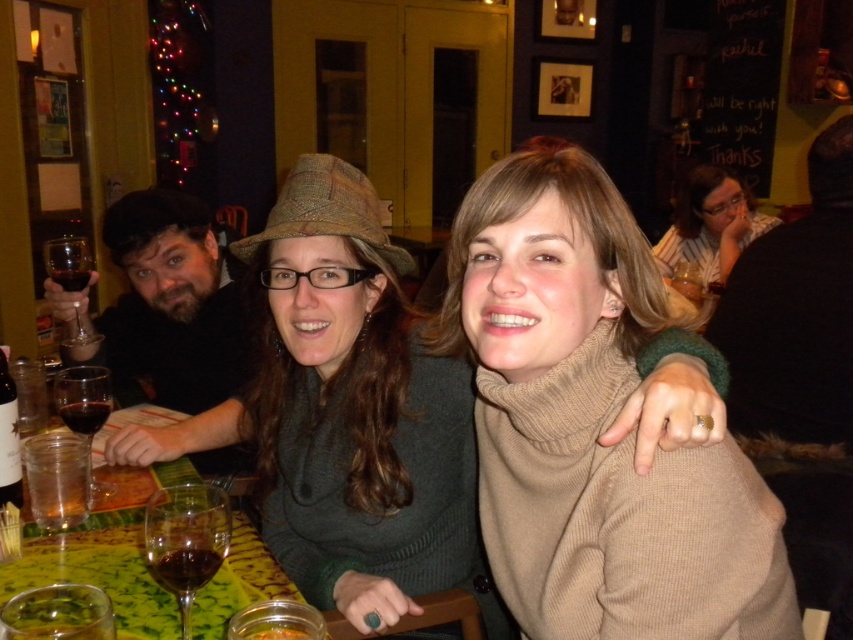
Question: Estimate the real-world distances between objects in this image. Which object is farther from the transparent glass at lower left?

Choices:
 (A) knitted green sweater at center
 (B) translucent glass at upper left
 (C) striped shirt at upper right
 (D) translucent glass wine at lower left

Answer: (C)

Question: Does transparent glass at left have a smaller size compared to translucent glass at upper left?

Choices:
 (A) yes
 (B) no

Answer: (B)

Question: Which of these objects is positioned farthest from the transparent glass at lower left?

Choices:
 (A) translucent glass at table left
 (B) transparent glass at left

Answer: (B)

Question: Observing the image, what is the correct spatial positioning of translucent glass wine glass at lower left in reference to striped shirt at upper right?

Choices:
 (A) above
 (B) below

Answer: (B)

Question: Which object is the farthest from the striped shirt at upper right?

Choices:
 (A) knitted green sweater at center
 (B) beige wool sweater at center
 (C) dark brown wool beret at left
 (D) translucent glass at upper left

Answer: (D)

Question: Can you confirm if dark brown wool beret at left is positioned below translucent glass wine glass at lower left?

Choices:
 (A) no
 (B) yes

Answer: (A)